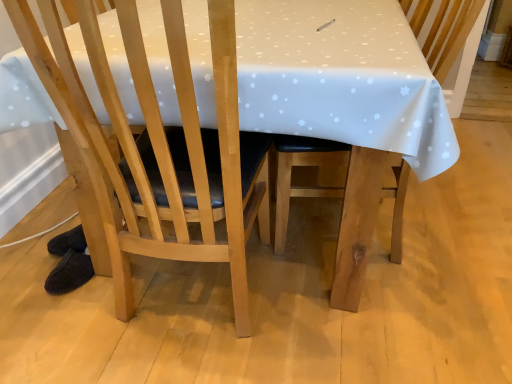
Find the location of a particular element. This screenshot has width=512, height=384. wooden chair at center, acting as the second chair starting from the left is located at coordinates (291, 175).

The height and width of the screenshot is (384, 512). Describe the element at coordinates (291, 175) in the screenshot. I see `wooden chair at center, acting as the second chair starting from the left` at that location.

This screenshot has height=384, width=512. Describe the element at coordinates (158, 142) in the screenshot. I see `light wood chair at center, marked as the second chair in a right-to-left arrangement` at that location.

Locate an element on the screen. The image size is (512, 384). light wood chair at center, marked as the 1th chair in a left-to-right arrangement is located at coordinates [x=158, y=142].

I want to click on wooden chair at center, the first chair when ordered from right to left, so click(291, 175).

Visually, is wooden chair at center, acting as the second chair starting from the left, positioned to the left or to the right of light wood chair at center, marked as the 1th chair in a left-to-right arrangement?

Clearly, wooden chair at center, acting as the second chair starting from the left, is on the right of light wood chair at center, marked as the 1th chair in a left-to-right arrangement, in the image.

Considering their positions, is wooden chair at center, the first chair when ordered from right to left, located in front of or behind light wood chair at center, marked as the second chair in a right-to-left arrangement?

wooden chair at center, the first chair when ordered from right to left, is positioned farther from the viewer than light wood chair at center, marked as the second chair in a right-to-left arrangement.

Is point (285, 171) closer or farther from the camera than point (59, 78)?

Clearly, point (285, 171) is more distant from the camera than point (59, 78).

From the image's perspective, which one is positioned lower, wooden chair at center, the first chair when ordered from right to left, or light wood chair at center, marked as the 1th chair in a left-to-right arrangement?

From the image's view, light wood chair at center, marked as the 1th chair in a left-to-right arrangement, is below.

From a real-world perspective, relative to light wood chair at center, marked as the 1th chair in a left-to-right arrangement, is wooden chair at center, the first chair when ordered from right to left, vertically above or below?

wooden chair at center, the first chair when ordered from right to left, is situated lower than light wood chair at center, marked as the 1th chair in a left-to-right arrangement, in the real world.

Considering the sizes of wooden chair at center, acting as the second chair starting from the left, and light wood chair at center, marked as the second chair in a right-to-left arrangement, in the image, is wooden chair at center, acting as the second chair starting from the left, wider or thinner than light wood chair at center, marked as the second chair in a right-to-left arrangement,?

wooden chair at center, acting as the second chair starting from the left, is wider than light wood chair at center, marked as the second chair in a right-to-left arrangement.

Is wooden chair at center, the first chair when ordered from right to left, taller or shorter than light wood chair at center, marked as the second chair in a right-to-left arrangement?

wooden chair at center, the first chair when ordered from right to left, is shorter than light wood chair at center, marked as the second chair in a right-to-left arrangement.

Considering the sizes of objects wooden chair at center, acting as the second chair starting from the left, and light wood chair at center, marked as the 1th chair in a left-to-right arrangement, in the image provided, who is bigger, wooden chair at center, acting as the second chair starting from the left, or light wood chair at center, marked as the 1th chair in a left-to-right arrangement,?

wooden chair at center, acting as the second chair starting from the left, is bigger.

Is wooden chair at center, the first chair when ordered from right to left, spatially inside light wood chair at center, marked as the 1th chair in a left-to-right arrangement, or outside of it?

wooden chair at center, the first chair when ordered from right to left, is located beyond the bounds of light wood chair at center, marked as the 1th chair in a left-to-right arrangement.

Is wooden chair at center, acting as the second chair starting from the left, far away from light wood chair at center, marked as the 1th chair in a left-to-right arrangement?

No, wooden chair at center, acting as the second chair starting from the left, is not far from light wood chair at center, marked as the 1th chair in a left-to-right arrangement.

Is light wood chair at center, marked as the 1th chair in a left-to-right arrangement, at the back of wooden chair at center, the first chair when ordered from right to left?

No, wooden chair at center, the first chair when ordered from right to left,'s orientation is not away from light wood chair at center, marked as the 1th chair in a left-to-right arrangement.

What's the angular difference between wooden chair at center, acting as the second chair starting from the left, and light wood chair at center, marked as the second chair in a right-to-left arrangement,'s facing directions?

There is a 90-degree angle between the facing directions of wooden chair at center, acting as the second chair starting from the left, and light wood chair at center, marked as the second chair in a right-to-left arrangement.

Where is `chair below the wooden chair at center, the first chair when ordered from right to left (from the image's perspective)`? The width and height of the screenshot is (512, 384). chair below the wooden chair at center, the first chair when ordered from right to left (from the image's perspective) is located at coordinates click(158, 142).

Considering the positions of objects light wood chair at center, marked as the second chair in a right-to-left arrangement, and wooden chair at center, the first chair when ordered from right to left, in the image provided, who is more to the left, light wood chair at center, marked as the second chair in a right-to-left arrangement, or wooden chair at center, the first chair when ordered from right to left,?

Positioned to the left is light wood chair at center, marked as the second chair in a right-to-left arrangement.

Is light wood chair at center, marked as the second chair in a right-to-left arrangement, further to the viewer compared to wooden chair at center, acting as the second chair starting from the left?

That is False.

Between point (176, 215) and point (461, 19), which one is positioned in front?

Positioned in front is point (176, 215).

From the image's perspective, which object appears higher, light wood chair at center, marked as the second chair in a right-to-left arrangement, or wooden chair at center, acting as the second chair starting from the left?

wooden chair at center, acting as the second chair starting from the left, is shown above in the image.

From a real-world perspective, relative to wooden chair at center, acting as the second chair starting from the left, is light wood chair at center, marked as the 1th chair in a left-to-right arrangement, vertically above or below?

light wood chair at center, marked as the 1th chair in a left-to-right arrangement, is situated higher than wooden chair at center, acting as the second chair starting from the left, in the real world.

Which object is thinner, light wood chair at center, marked as the 1th chair in a left-to-right arrangement, or wooden chair at center, acting as the second chair starting from the left?

With smaller width is light wood chair at center, marked as the 1th chair in a left-to-right arrangement.

Considering the sizes of objects light wood chair at center, marked as the 1th chair in a left-to-right arrangement, and wooden chair at center, acting as the second chair starting from the left, in the image provided, who is shorter, light wood chair at center, marked as the 1th chair in a left-to-right arrangement, or wooden chair at center, acting as the second chair starting from the left,?

wooden chair at center, acting as the second chair starting from the left, is shorter.

Between light wood chair at center, marked as the 1th chair in a left-to-right arrangement, and wooden chair at center, the first chair when ordered from right to left, which one has smaller size?

With smaller size is light wood chair at center, marked as the 1th chair in a left-to-right arrangement.

Would you say light wood chair at center, marked as the second chair in a right-to-left arrangement, is inside or outside wooden chair at center, acting as the second chair starting from the left?

light wood chair at center, marked as the second chair in a right-to-left arrangement, cannot be found inside wooden chair at center, acting as the second chair starting from the left.

Is light wood chair at center, marked as the 1th chair in a left-to-right arrangement, next to wooden chair at center, the first chair when ordered from right to left?

No, light wood chair at center, marked as the 1th chair in a left-to-right arrangement, is not in contact with wooden chair at center, the first chair when ordered from right to left.

Could you tell me if light wood chair at center, marked as the 1th chair in a left-to-right arrangement, is turned towards wooden chair at center, the first chair when ordered from right to left?

No.

How far apart are light wood chair at center, marked as the 1th chair in a left-to-right arrangement, and wooden chair at center, the first chair when ordered from right to left?

light wood chair at center, marked as the 1th chair in a left-to-right arrangement, is 29.62 inches away from wooden chair at center, the first chair when ordered from right to left.

The image size is (512, 384). Find the location of `chair above the wooden chair at center, the first chair when ordered from right to left (from a real-world perspective)`. chair above the wooden chair at center, the first chair when ordered from right to left (from a real-world perspective) is located at coordinates (158, 142).

This screenshot has width=512, height=384. In order to click on chair below the wooden chair at center, acting as the second chair starting from the left (from the image's perspective) in this screenshot , I will do `click(158, 142)`.

This screenshot has width=512, height=384. I want to click on chair behind the light wood chair at center, marked as the 1th chair in a left-to-right arrangement, so click(291, 175).